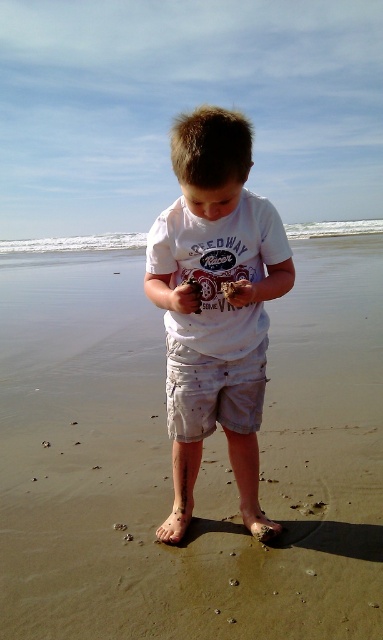
Question: Can you confirm if brown sandy beach at center is thinner than white cotton shirt at center?

Choices:
 (A) yes
 (B) no

Answer: (B)

Question: Which point is closer to the camera taking this photo?

Choices:
 (A) (193, 276)
 (B) (229, 401)
 (C) (227, 248)
 (D) (270, 355)

Answer: (C)

Question: Among these points, which one is farthest from the camera?

Choices:
 (A) (235, 394)
 (B) (196, 312)
 (C) (142, 307)

Answer: (C)

Question: Which object appears farthest from the camera in this image?

Choices:
 (A) matte white sand at center
 (B) brown sandy beach at center
 (C) smooth brown rock at center
 (D) white cotton shirt at center

Answer: (B)

Question: Can you confirm if white cotton shirt at center is positioned above smooth brown rock at center?

Choices:
 (A) yes
 (B) no

Answer: (B)

Question: Is white cotton shirt at center further to camera compared to matte white sand at center?

Choices:
 (A) yes
 (B) no

Answer: (B)